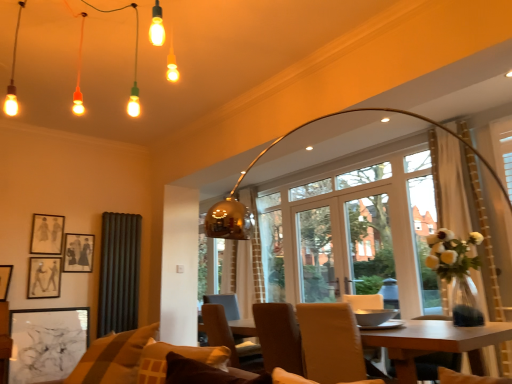
Question: Would you say matte black picture frame at upper left, the 4th picture frame ordered from the bottom, contains black matte picture frame at lower left, the first picture frame in the bottom-to-top sequence?

Choices:
 (A) no
 (B) yes

Answer: (A)

Question: Is matte black picture frame at upper left, the 4th picture frame ordered from the bottom, further to camera compared to black matte picture frame at lower left, acting as the 4th picture frame starting from the top?

Choices:
 (A) yes
 (B) no

Answer: (A)

Question: Would you consider matte black picture frame at upper left, the 4th picture frame ordered from the bottom, to be distant from black matte picture frame at lower left, the first picture frame in the bottom-to-top sequence?

Choices:
 (A) no
 (B) yes

Answer: (A)

Question: From the image's perspective, would you say matte black picture frame at upper left, the 4th picture frame ordered from the bottom, is positioned over black matte picture frame at lower left, acting as the 4th picture frame starting from the top?

Choices:
 (A) no
 (B) yes

Answer: (B)

Question: Is matte black picture frame at upper left, the 1th picture frame viewed from the top, positioned with its back to black matte picture frame at lower left, acting as the 4th picture frame starting from the top?

Choices:
 (A) no
 (B) yes

Answer: (A)

Question: Does matte black picture frame at upper left, the 1th picture frame viewed from the top, have a larger size compared to black matte picture frame at lower left, acting as the 4th picture frame starting from the top?

Choices:
 (A) yes
 (B) no

Answer: (B)

Question: Is wooden table at center aimed at black matte picture frame at upper left, arranged as the third picture frame when viewed from the top?

Choices:
 (A) no
 (B) yes

Answer: (A)

Question: From a real-world perspective, is wooden table at center physically above black matte picture frame at upper left, which appears as the second picture frame when ordered from the bottom?

Choices:
 (A) yes
 (B) no

Answer: (B)

Question: Can you confirm if wooden table at center is positioned to the right of black matte picture frame at upper left, which appears as the second picture frame when ordered from the bottom?

Choices:
 (A) yes
 (B) no

Answer: (A)

Question: From the image's perspective, is wooden table at center located beneath black matte picture frame at upper left, arranged as the third picture frame when viewed from the top?

Choices:
 (A) yes
 (B) no

Answer: (A)

Question: Is wooden table at center positioned behind black matte picture frame at upper left, arranged as the third picture frame when viewed from the top?

Choices:
 (A) yes
 (B) no

Answer: (B)

Question: Is there a large distance between wooden table at center and black matte picture frame at upper left, which appears as the second picture frame when ordered from the bottom?

Choices:
 (A) yes
 (B) no

Answer: (A)

Question: From the image's perspective, is brown leather chair at center, the second chair from the front, above matte black picture frame at upper left, the 1th picture frame viewed from the top?

Choices:
 (A) no
 (B) yes

Answer: (A)